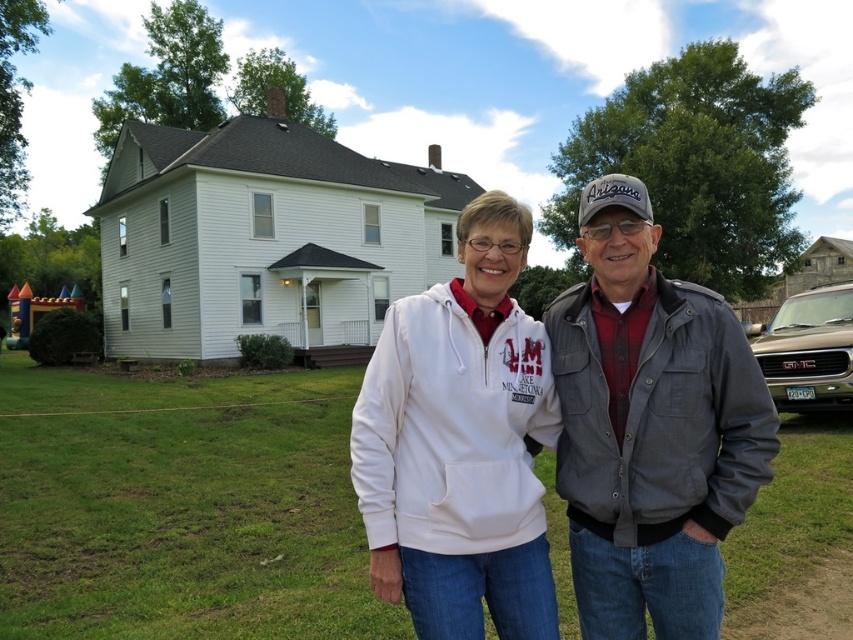
Question: Is gray cotton jacket at center wider than white fleece hoodie at center?

Choices:
 (A) no
 (B) yes

Answer: (A)

Question: Based on their relative distances, which object is nearer to the green grass at lower center?

Choices:
 (A) white fleece hoodie at center
 (B) gray cotton jacket at center

Answer: (A)

Question: Is green grass at lower center to the right of white fleece hoodie at center from the viewer's perspective?

Choices:
 (A) no
 (B) yes

Answer: (A)

Question: Is green grass at lower center further to camera compared to white fleece hoodie at center?

Choices:
 (A) no
 (B) yes

Answer: (B)

Question: Considering the real-world distances, which object is farthest from the white fleece hoodie at center?

Choices:
 (A) gray cotton jacket at center
 (B) green grass at lower center

Answer: (B)

Question: Which point is closer to the camera taking this photo?

Choices:
 (A) (500, 250)
 (B) (682, 324)
 (C) (219, 625)

Answer: (B)